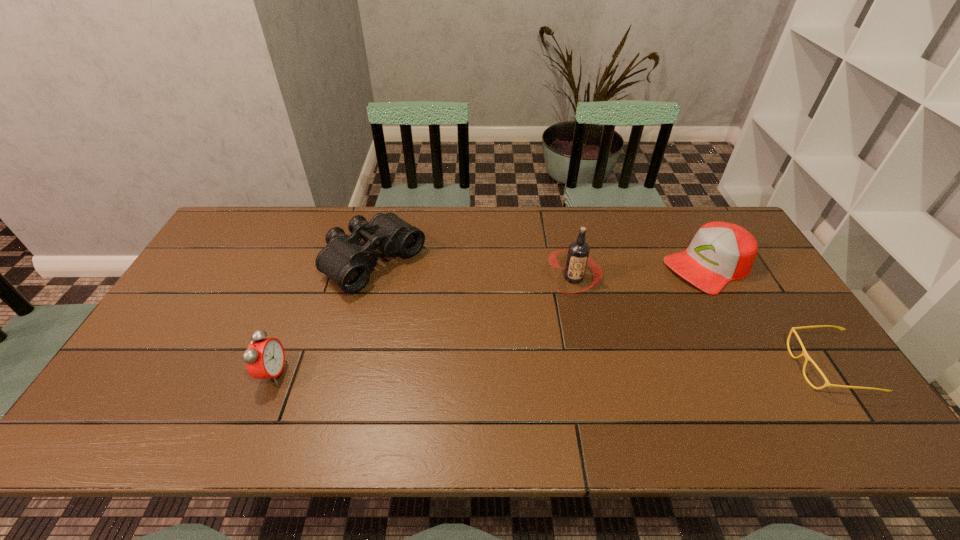
Locate an element on the screen. This screenshot has height=540, width=960. vacant spot on the desktop that is between the alarm clock and the spectacles and is positioned on the label of the third object from right to left is located at coordinates (554, 370).

Where is `vacant space on the desktop that is between the alarm clock and the spectacles and is positioned at the eyepieces of the binoculars`? vacant space on the desktop that is between the alarm clock and the spectacles and is positioned at the eyepieces of the binoculars is located at coordinates (522, 370).

This screenshot has width=960, height=540. I want to click on vacant spot on the desktop that is between the alarm clock and the shortest object and is positioned on the front-facing side of the baseball cap, so (527, 370).